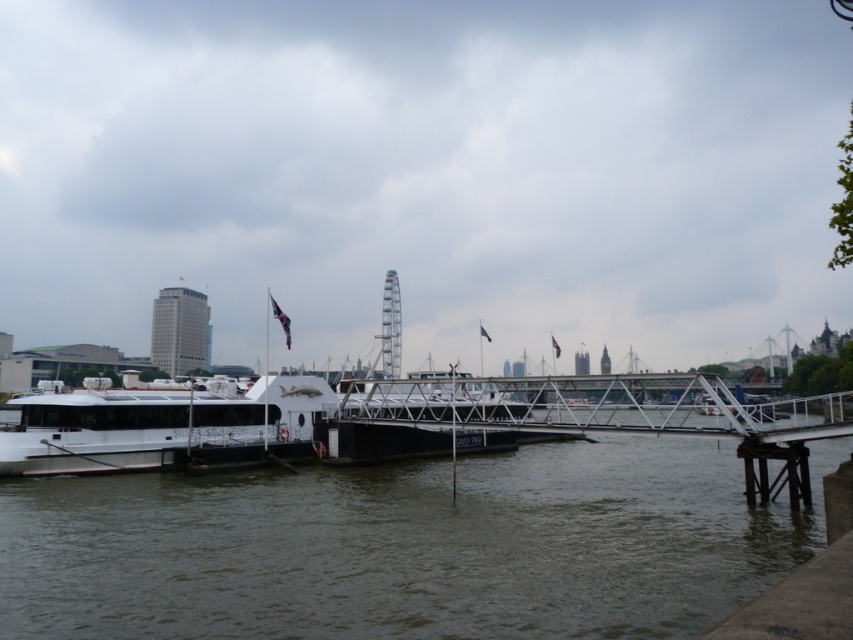
Is brown water at lower left shorter than white matte boat at left?

No.

Is point (44, 541) closer to camera compared to point (206, 381)?

Yes.

The image size is (853, 640). What are the coordinates of `brown water at lower left` in the screenshot? It's located at (407, 547).